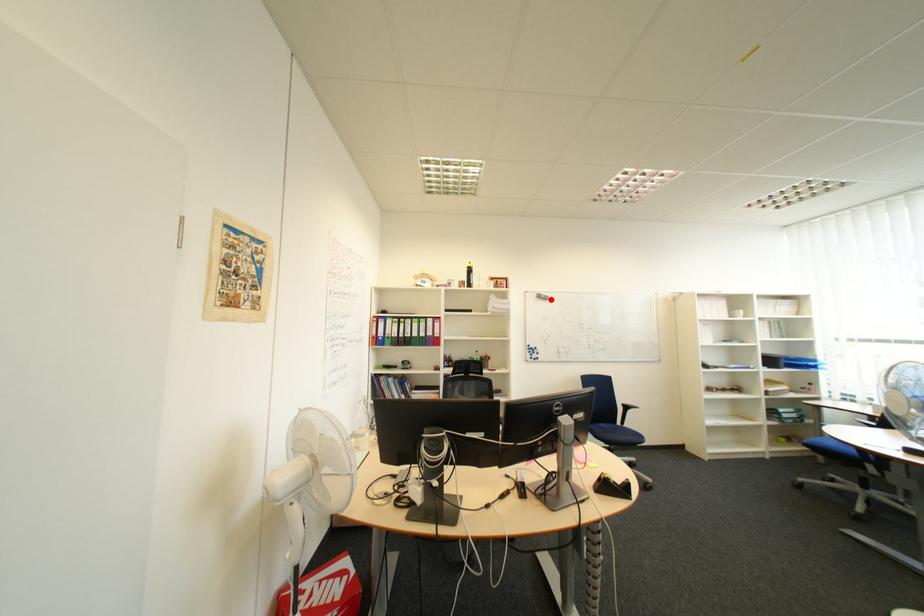
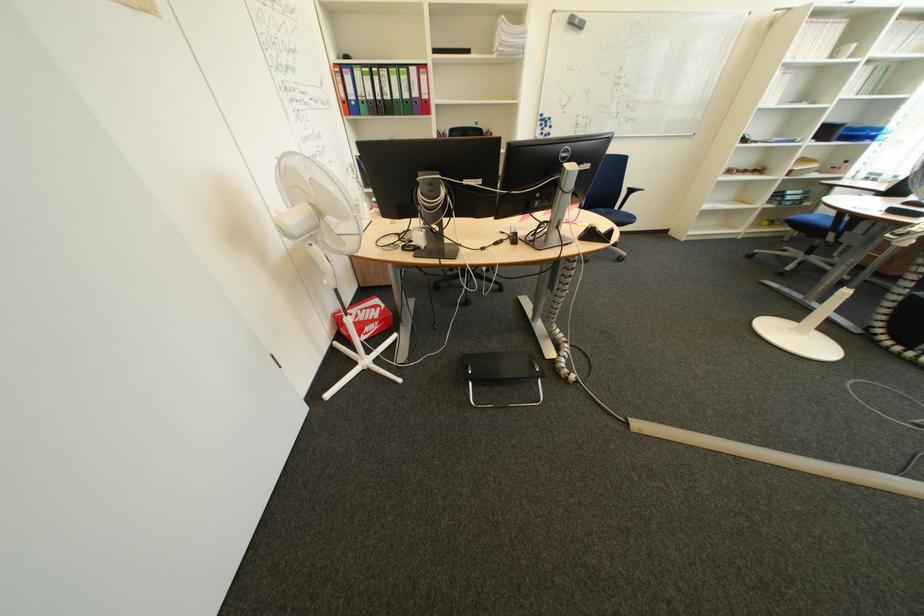
Locate, in the second image, the point that corresponds to the highlighted location in the first image.

(581, 28)